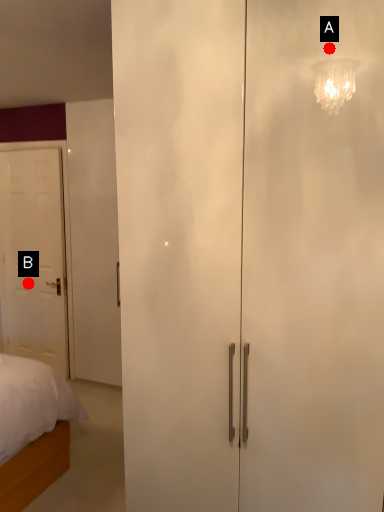
Question: Two points are circled on the image, labeled by A and B beside each circle. Among these points, which one is nearest to the camera?

Choices:
 (A) A is closer
 (B) B is closer

Answer: (A)